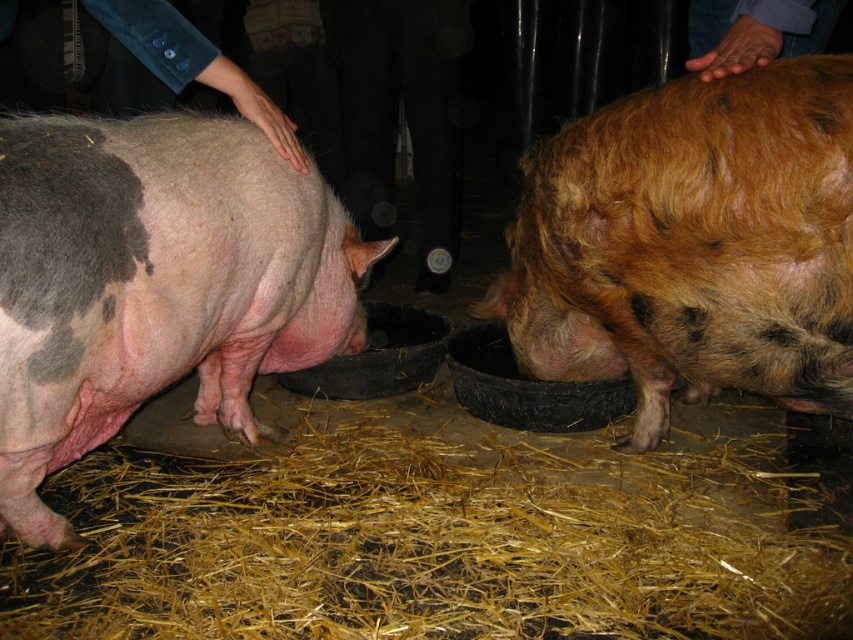
You are standing at the point with coordinates (440, 540) in the barn. What object is located exactly at your current position?

The yellow straw at lower center is located exactly at the point with coordinates (440, 540).

You are a farmer checking the barn. You notice the yellow straw at lower center and the speckled pink pig at left. Which object is taller?

The speckled pink pig at left is taller than the yellow straw at lower center according to the description.

You are standing in front of the pigs and want to take a photo. Which of the two points, point (485, 520) or point (795, 308), is closer to your camera?

Point (485, 520) is further to the camera than point (795, 308), so the closer point to your camera is point (795, 308).